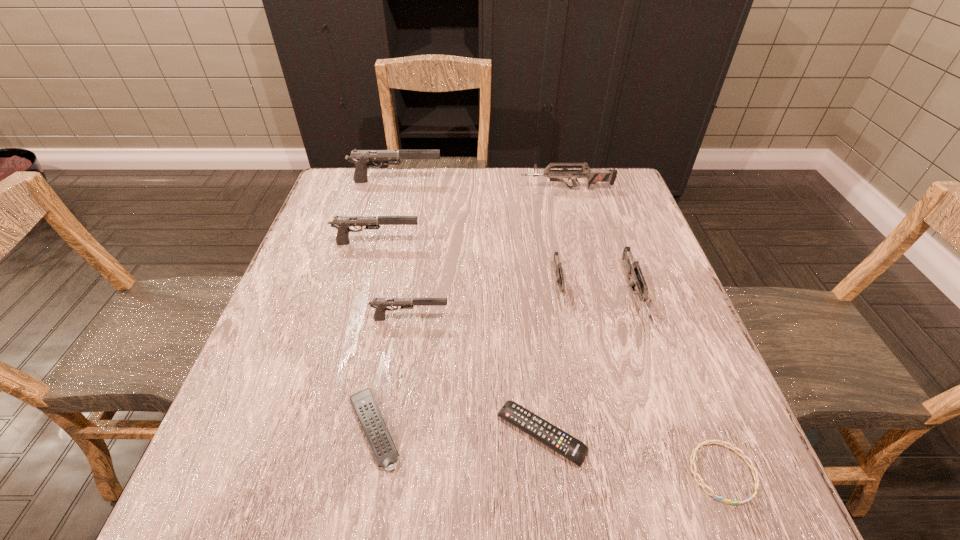
I want to click on gray gun that is the third closest one to the shortest gun, so click(x=361, y=158).

I want to click on grey gun that is the closest to the sixth tallest object, so click(633, 268).

Locate which grey gun ranks third in proximity to the left remote control. Please provide its 2D coordinates. Your answer should be formatted as a tuple, i.e. [(x, y)], where the tuple contains the x and y coordinates of a point satisfying the conditions above.

[(593, 176)]

Find the location of a particular element. The width and height of the screenshot is (960, 540). vacant region that satisfies the following two spatial constraints: 1. at the muzzle end of the second biggest gray gun; 2. on the back side of the left remote control is located at coordinates (327, 429).

Locate an element on the screen. Image resolution: width=960 pixels, height=540 pixels. free spot that satisfies the following two spatial constraints: 1. aimed along the barrel of the second biggest grey gun; 2. at the muzzle end of the nearest gray gun is located at coordinates (642, 319).